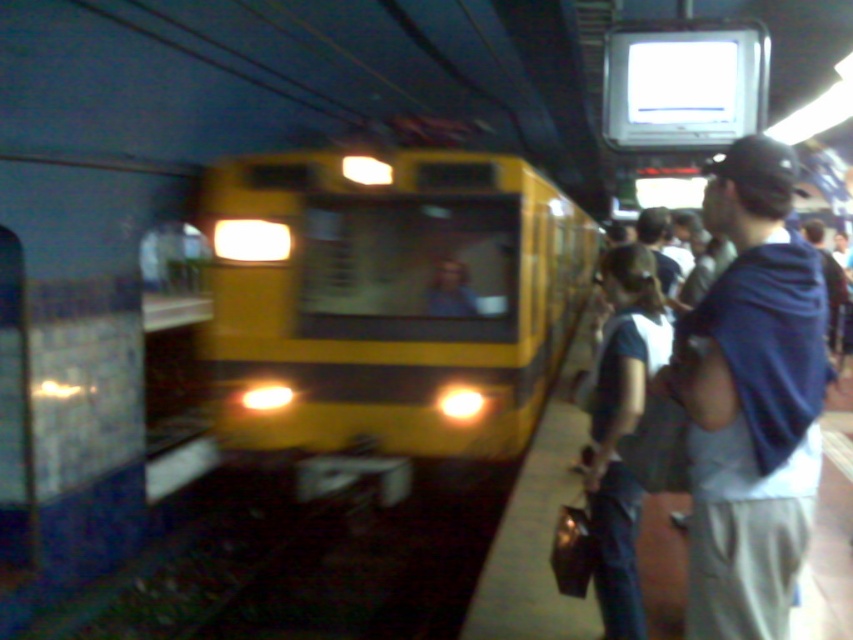
You are standing at the subway station and want to take a photo of the train approaching the platform. If you position yourself at point (309, 220), how far will you be from the camera taking the photo?

The distance of point (309, 220) from the camera is 5.87 meters, so you will be 5.87 meters away from the camera.

You are a passenger at the subway station. You see the yellow matte train at center and the dark blue fabric draped at right. Which object is closer to the platform edge?

The yellow matte train at center is closer to the platform edge because it is positioned over the dark blue fabric draped at right, indicating it is in front of it.

You are a passenger on the platform waiting to board the yellow matte train at center. You notice the dark blue fabric draped at right. Is the fabric in front of or behind the train?

The dark blue fabric draped at right is behind the yellow matte train at center.